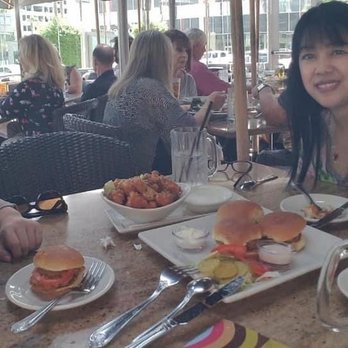
What are the coordinates of `handle` in the screenshot? It's located at (333, 257), (328, 277), (324, 306), (330, 325).